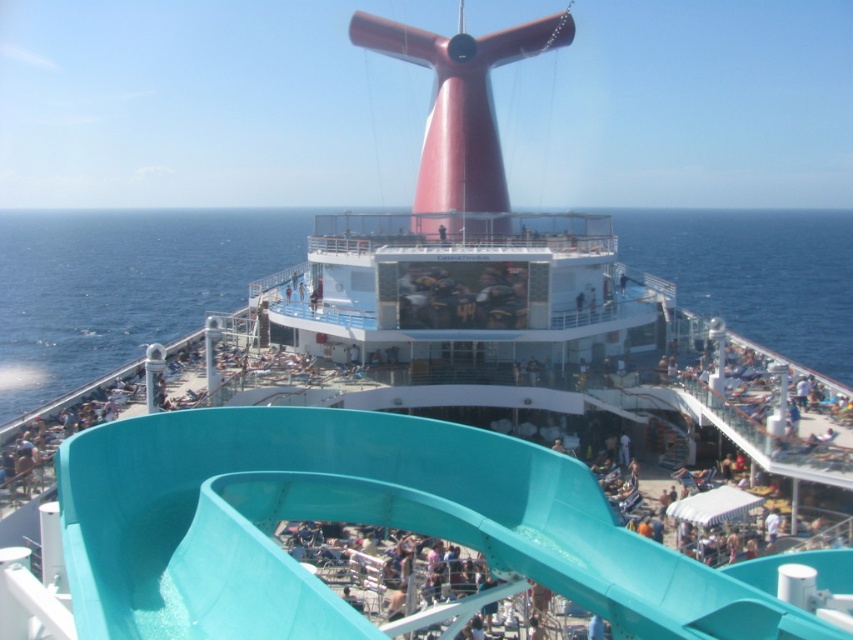
You are a passenger on the cruise ship and want to take a photo of both the teal plastic slide at center and the teal plastic water slide at upper center. Which one should you focus on first to ensure both are in the frame?

You should focus on the teal plastic water slide at upper center first because the teal plastic slide at center is closer to the viewer, so adjusting the camera to include both would require ensuring the closer one is framed without cutting it off while including the farther one in the background.

You are standing on the cruise ship deck and want to take a photo of both the water slide and the sunbathers. You notice two points marked on your map corresponding to your current location and the best vantage points. The first point is at coordinates point [198,588], and the second is at point [148,314]. Which point would allow you to capture both the water slide and the sunbathers in the same frame without needing to move?

Point [198,588] is closer to the camera than point [148,314], so choosing the first point would provide a better vantage point to capture both the water slide and the sunbathers in the same frame without needing to move.